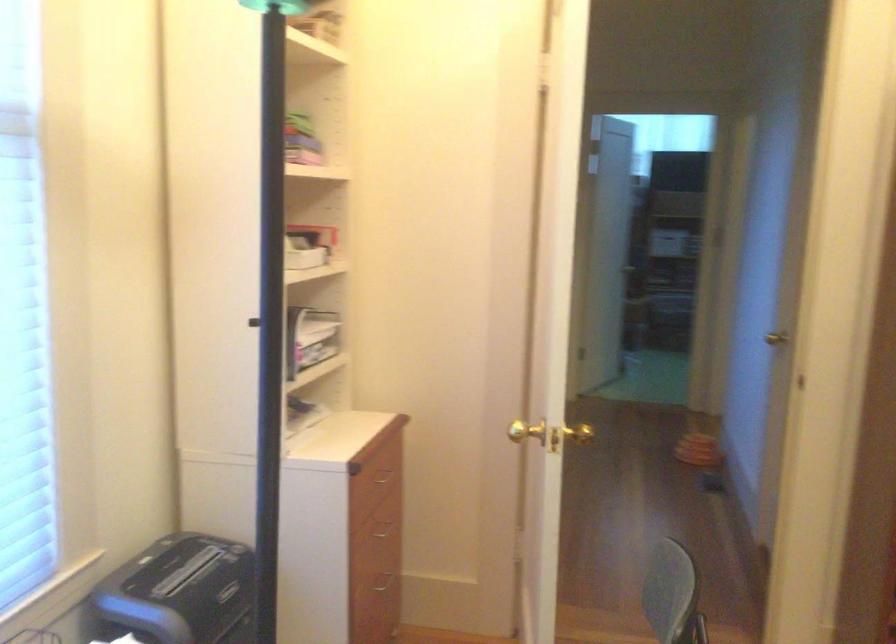
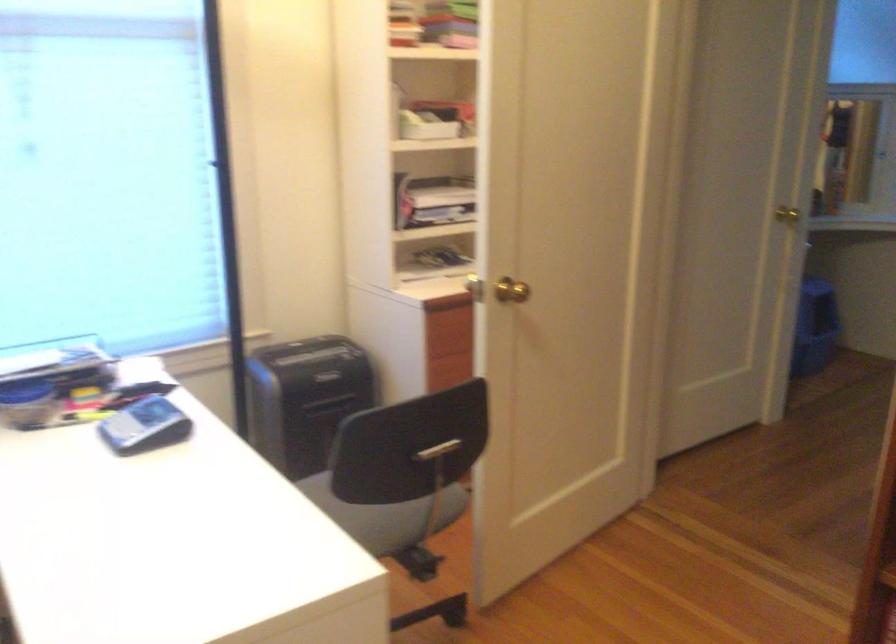
Question: I am providing you with two images of the same scene from different viewpoints. Please identify which objects are invisible in image2.

Choices:
 (A) black locker lock
 (B) drawer handle
 (C) grey calculator
 (D) chair sitting surface

Answer: (B)